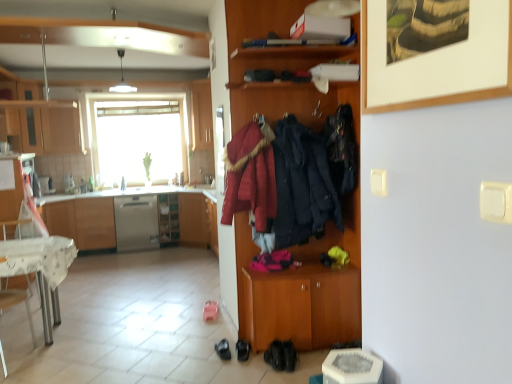
This screenshot has width=512, height=384. Find the location of `free region under black leather shoes at lower center, which is counted as the third footwear, starting from the right (from a real-world perspective)`. free region under black leather shoes at lower center, which is counted as the third footwear, starting from the right (from a real-world perspective) is located at coordinates (222, 351).